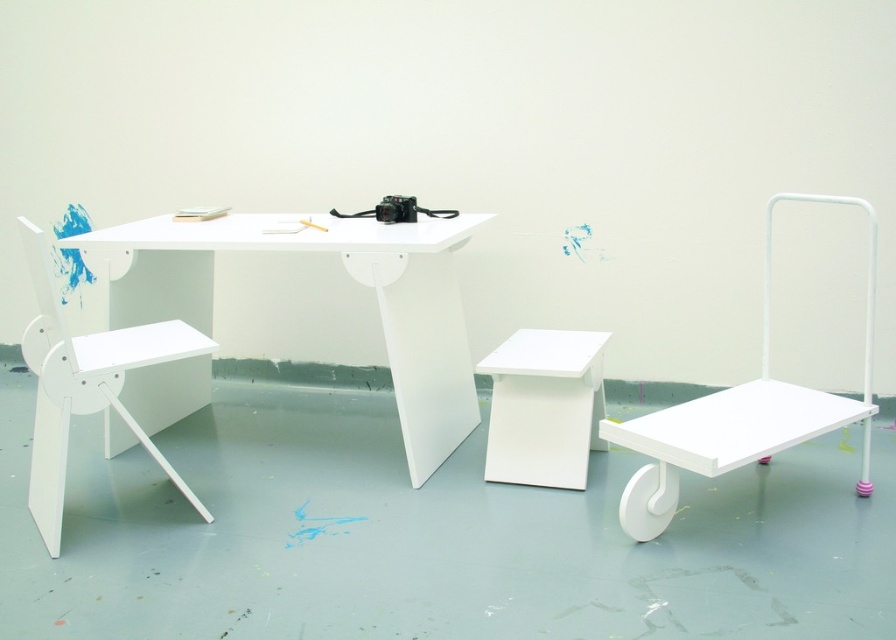
Question: Is white matte table at center in front of white matte chair at left?

Choices:
 (A) no
 (B) yes

Answer: (A)

Question: Does white matte table at center appear on the right side of white matte chair at left?

Choices:
 (A) yes
 (B) no

Answer: (A)

Question: Which point appears closest to the camera in this image?

Choices:
 (A) (326, 296)
 (B) (178, 330)
 (C) (576, 387)

Answer: (B)

Question: In this image, where is white matte table at center located relative to white matte stool at center?

Choices:
 (A) below
 (B) above

Answer: (B)

Question: Which object appears closest to the camera in this image?

Choices:
 (A) white matte table at center
 (B) white matte chair at left

Answer: (B)

Question: Which object appears closest to the camera in this image?

Choices:
 (A) white matte chair at left
 (B) white matte stool at center
 (C) white matte table at center

Answer: (A)